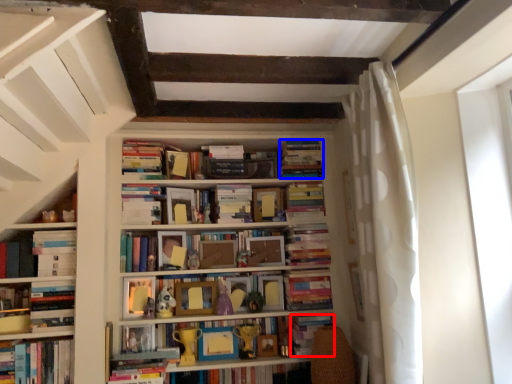
Question: Among these objects, which one is farthest to the camera, paperback book (highlighted by a red box) or book (highlighted by a blue box)?

Choices:
 (A) paperback book
 (B) book

Answer: (B)